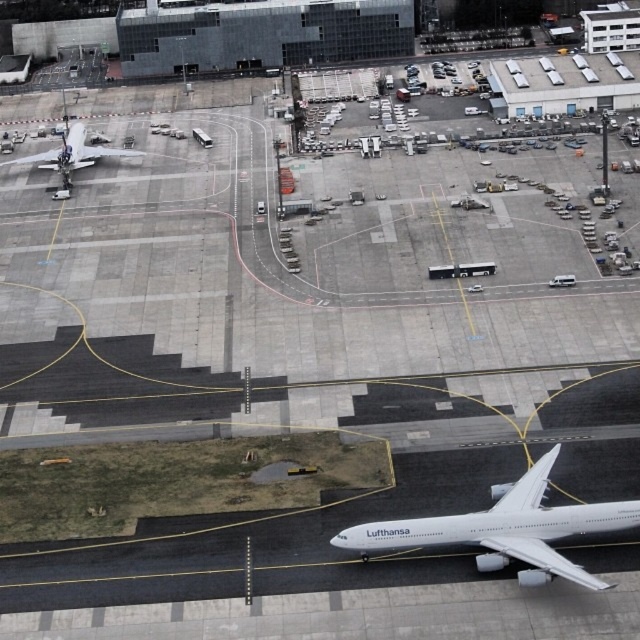
Question: Does dark gray glass building at upper center appear on the left side of white glossy airplane at upper left?

Choices:
 (A) yes
 (B) no

Answer: (B)

Question: Is dark gray glass building at upper center to the left of white glossy airplane at upper left from the viewer's perspective?

Choices:
 (A) yes
 (B) no

Answer: (B)

Question: Considering the real-world distances, which object is farthest from the white glossy airplane at upper left?

Choices:
 (A) dark gray glass building at upper center
 (B) white matte airplane at lower right

Answer: (B)

Question: Which object appears closest to the camera in this image?

Choices:
 (A) white glossy airplane at upper left
 (B) white matte airplane at lower right

Answer: (B)

Question: In this image, where is dark gray glass building at upper center located relative to white glossy airplane at upper left?

Choices:
 (A) right
 (B) left

Answer: (A)

Question: Considering the real-world distances, which object is closest to the white glossy airplane at upper left?

Choices:
 (A) dark gray glass building at upper center
 (B) white matte airplane at lower right

Answer: (A)